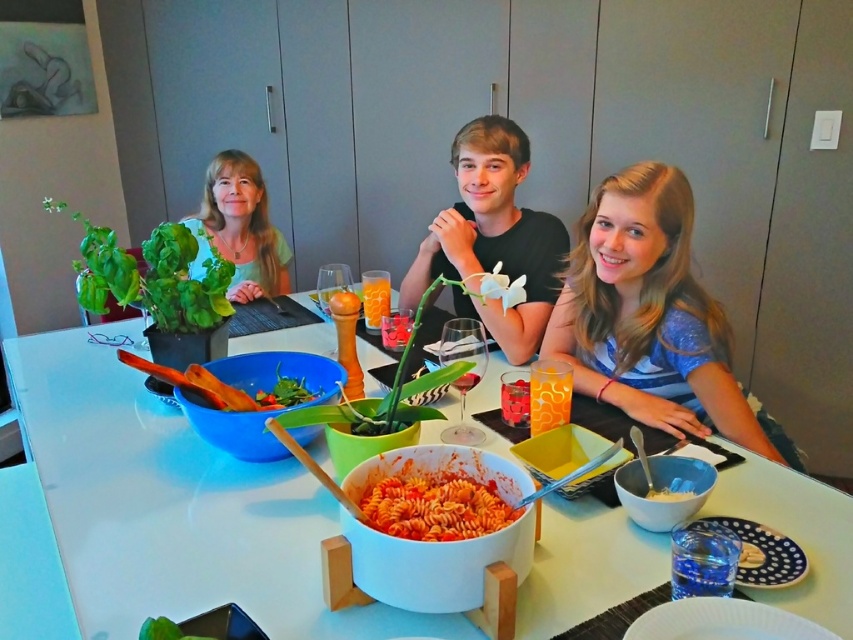
In the scene shown: You are a server at a restaurant and need to deliver a dessert plate to the table. You must place it between the blue striped shirt at center and the black matte shirt at center so that it is equally accessible to both. Is there enough space between them to place the dessert plate?

The blue striped shirt at center and black matte shirt at center are 33.22 centimeters apart. A standard dessert plate is approximately 20 centimeters in diameter. Since the distance between them is greater than the plate diameter, there is enough space to place the dessert plate between them so that it is equally accessible to both.

You are a waiter at the restaurant and need to place a new drink order on the table. The drink needs to be placed between the black matte shirt at center and the white matte bowl at center. Where should you place the drink?

The black matte shirt at center is positioned on the left side of white matte bowl at center, so you should place the drink between them to the right of the black matte shirt at center and to the left of the white matte bowl at center.

You are a guest at the dinner table and want to choose a shirt to wear for the meal. The blue striped shirt at center and the black matte shirt at center are available. Which shirt is smaller in size?

The blue striped shirt at center is smaller than the black matte shirt at center, so the blue striped shirt at center is the smaller option available.